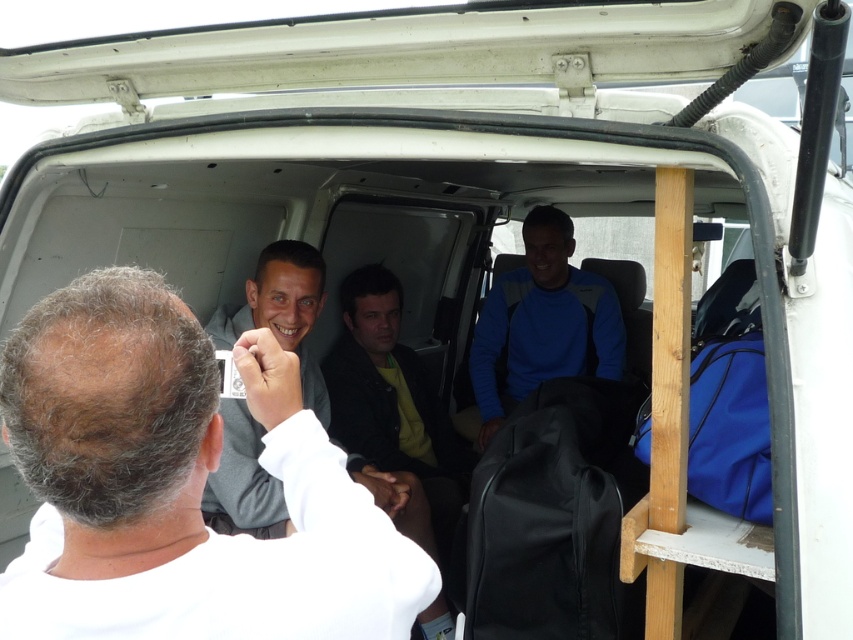
Is point (592, 324) in front of point (263, 490)?

No, it is not.

Which is behind, point (561, 284) or point (260, 506)?

Point (561, 284)

Which is in front, point (566, 376) or point (233, 340)?

Positioned in front is point (233, 340).

This screenshot has height=640, width=853. Identify the location of blue fleece jacket at center. click(x=543, y=323).

Is white matte shirt at center closer to the viewer compared to blue fleece jacket at center?

Yes, white matte shirt at center is closer to the viewer.

Between white matte shirt at center and blue fleece jacket at center, which one appears on the left side from the viewer's perspective?

white matte shirt at center

Is point (21, 598) less distant than point (573, 317)?

Yes.

Locate an element on the screen. Image resolution: width=853 pixels, height=640 pixels. white matte shirt at center is located at coordinates (183, 483).

Does white matte shirt at center appear over gray matte jacket at center?

Yes, white matte shirt at center is above gray matte jacket at center.

This screenshot has width=853, height=640. What are the coordinates of `white matte shirt at center` in the screenshot? It's located at (183, 483).

Where is `white matte shirt at center`? The height and width of the screenshot is (640, 853). white matte shirt at center is located at coordinates (183, 483).